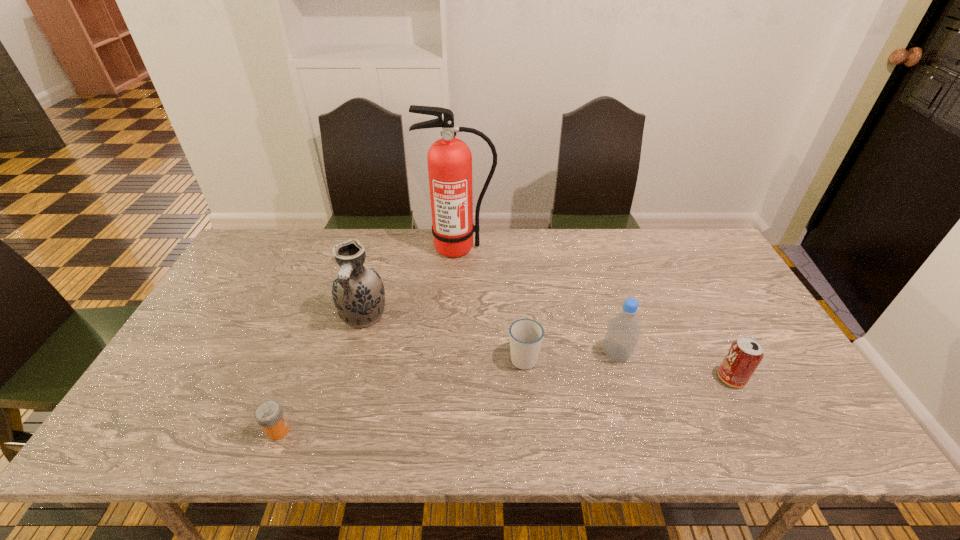
Image resolution: width=960 pixels, height=540 pixels. What are the coordinates of `fire extinguisher` in the screenshot? It's located at (449, 159).

Find the location of `the fourth object from right to left`. the fourth object from right to left is located at coordinates (449, 159).

You are a GUI agent. You are given a task and a screenshot of the screen. Output one action in this format:
    pyautogui.click(x=<x>, y=<y>)
    Task: Click on the fifth shortest object
    This screenshot has width=960, height=540.
    Given the screenshot: What is the action you would take?
    pyautogui.click(x=358, y=293)

You are a GUI agent. You are given a task and a screenshot of the screen. Output one action in this format:
    pyautogui.click(x=<x>, y=<y>)
    Task: Click on the vase
    The height and width of the screenshot is (540, 960).
    Given the screenshot: What is the action you would take?
    pyautogui.click(x=358, y=293)

Where is `bottle`? bottle is located at coordinates [x=623, y=330].

This screenshot has width=960, height=540. Identify the location of the second object from right to left. (623, 330).

At what (x,y) coordinates should I click in order to perform the action: click on soda can. Please return your answer as a coordinate pair (x, y). The width and height of the screenshot is (960, 540). Looking at the image, I should click on click(745, 354).

I want to click on cup, so click(x=526, y=335).

At what (x,y) coordinates should I click in order to perform the action: click on the nearest object. Please return your answer as a coordinate pair (x, y). Looking at the image, I should click on (269, 414).

Where is `the shortest object`? the shortest object is located at coordinates (269, 414).